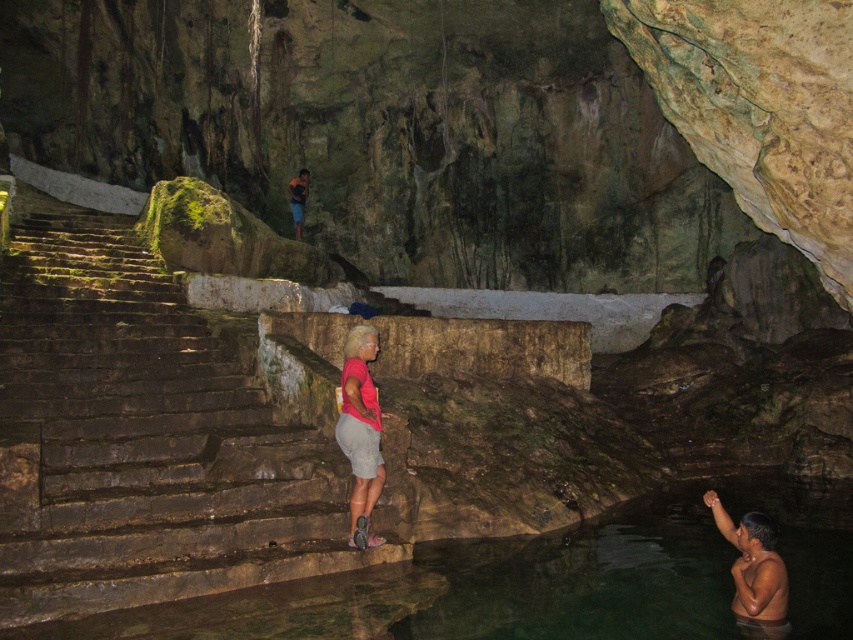
Does point (364, 508) come behind point (769, 563)?

That is True.

Is point (357, 547) positioned before point (770, 602)?

No, (357, 547) is behind (770, 602).

What are the coordinates of `pink fabric shorts at center` in the screenshot? It's located at (360, 428).

Between rustic stone stairs at center and smooth skin man at lower right, which one is positioned higher?

rustic stone stairs at center

Is rustic stone stairs at center wider than smooth skin man at lower right?

Yes, rustic stone stairs at center is wider than smooth skin man at lower right.

Where is `rustic stone stairs at center`? Image resolution: width=853 pixels, height=640 pixels. rustic stone stairs at center is located at coordinates (142, 449).

The height and width of the screenshot is (640, 853). Describe the element at coordinates (483, 588) in the screenshot. I see `clear water at edge bottom` at that location.

Is clear water at edge bottom wider than pink fabric shorts at center?

Correct, the width of clear water at edge bottom exceeds that of pink fabric shorts at center.

Identify the location of clear water at edge bottom. This screenshot has width=853, height=640. (483, 588).

You are a GUI agent. You are given a task and a screenshot of the screen. Output one action in this format:
    pyautogui.click(x=<x>, y=<y>)
    Task: Click on the clear water at edge bottom
    The image size is (853, 640).
    Given the screenshot: What is the action you would take?
    pyautogui.click(x=483, y=588)